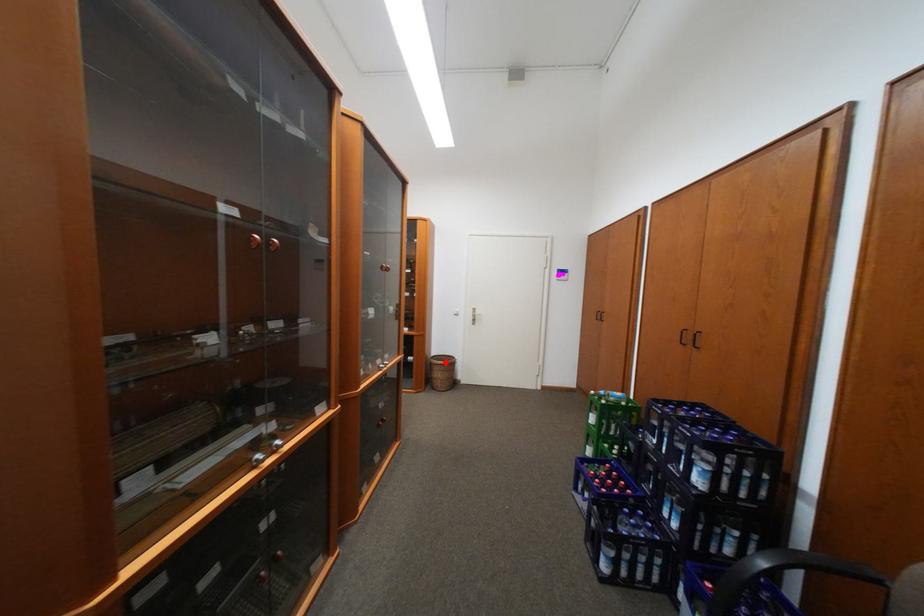
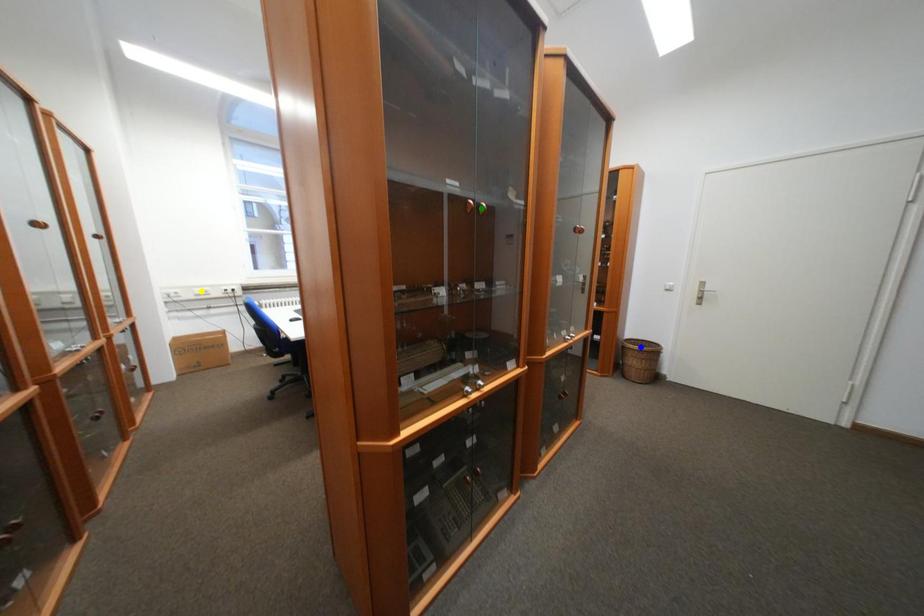
Question: I am providing you with two images of the same scene from different viewpoints. A red point is marked on the first image. You are given multiple points on the second image. Which spot in image 2 lines up with the point in image 1?

Choices:
 (A) green point
 (B) yellow point
 (C) blue point

Answer: (C)